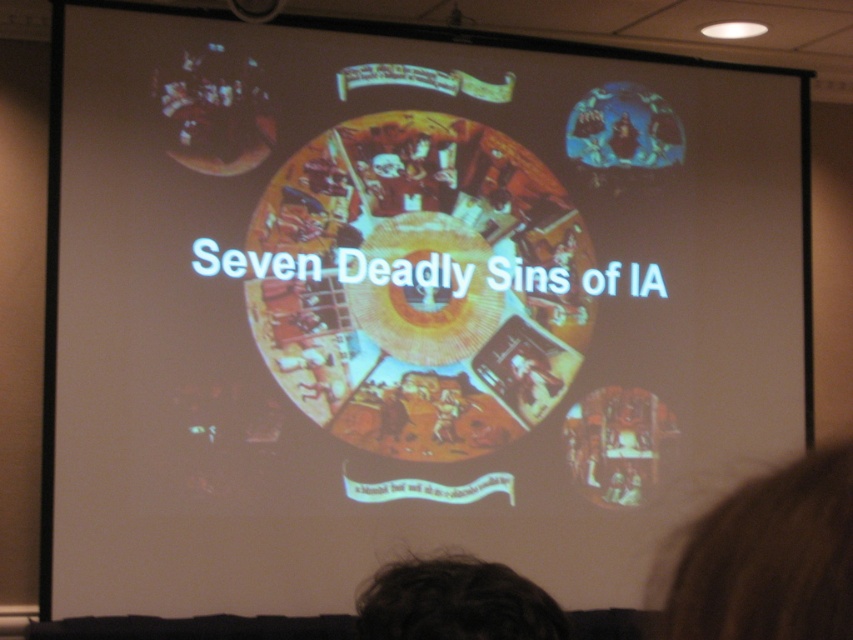
You are an attendee at a conference presentation about Information Architecture. You notice two people in the audience. One has brown fuzzy hair at lower right and another has dark hair at lower center. Which person has hair that is smaller in size?

The brown fuzzy hair at lower right has a smaller size compared to the dark hair at lower center.

You are a speaker standing at the front of the room. You want to adjust your microphone, which is placed at the dark hair at lower center. However, you notice a brown fuzzy hair at lower right that might be distracting. Can you reach both the microphone and the distracting hair with your 1.5 meter long reach?

The brown fuzzy hair at lower right is 3.77 meters away from dark hair at lower center. Since your reach is only 1.5 meters, you cannot reach both the microphone at dark hair at lower center and the brown fuzzy hair at lower right simultaneously.

You are an attendee at the conference, and you want to take a photo of the slide. However, you notice two people in front of you. One has brown fuzzy hair at lower right and the other has dark hair at lower center. Which person is closer to you, blocking your view?

The brown fuzzy hair at lower right is closer to you since it is in front of the dark hair at lower center, making it the closer obstruction.